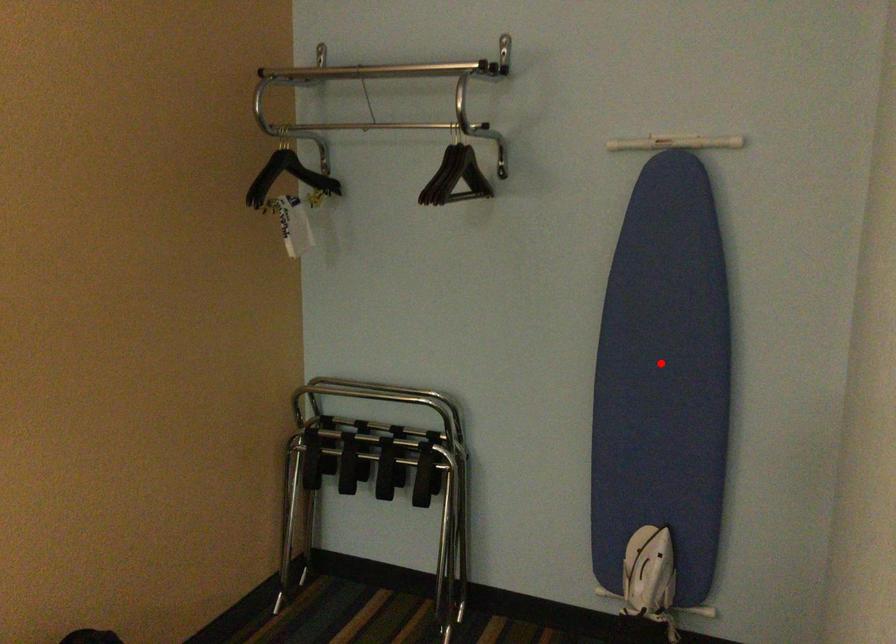
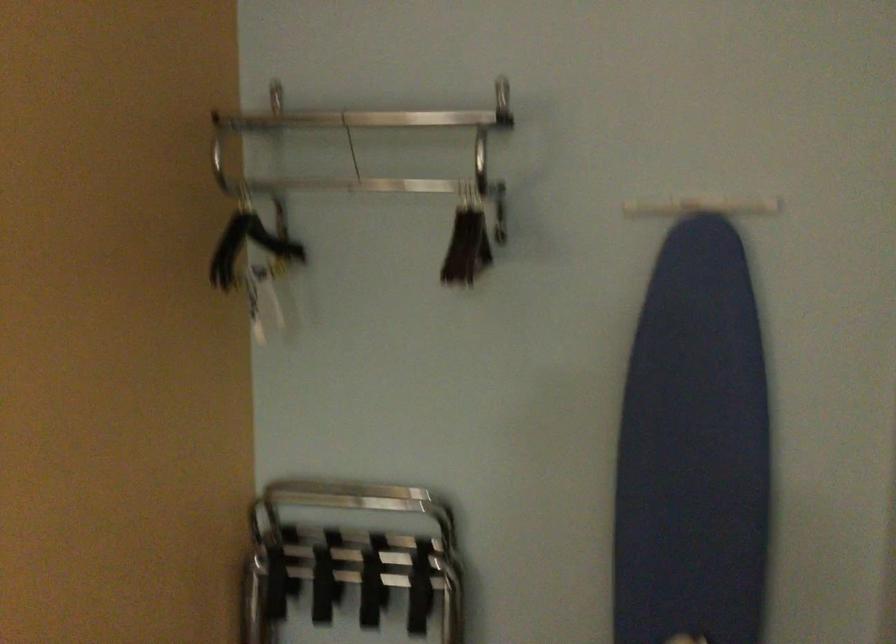
Question: I am providing you with two images of the same scene from different viewpoints. A red point is shown in image1. For the corresponding object point in image2, is it positioned nearer or farther from the camera?

Choices:
 (A) Nearer
 (B) Farther

Answer: (A)